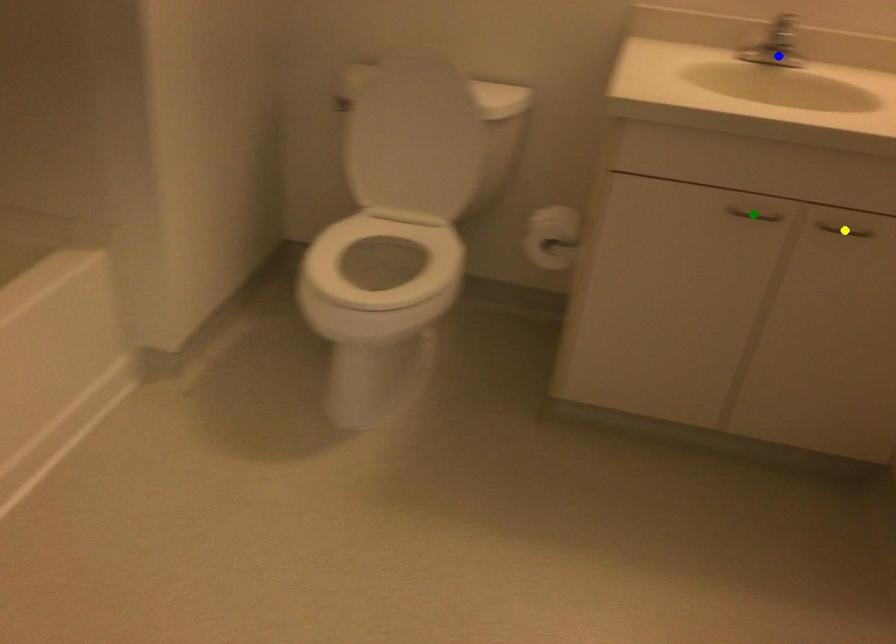
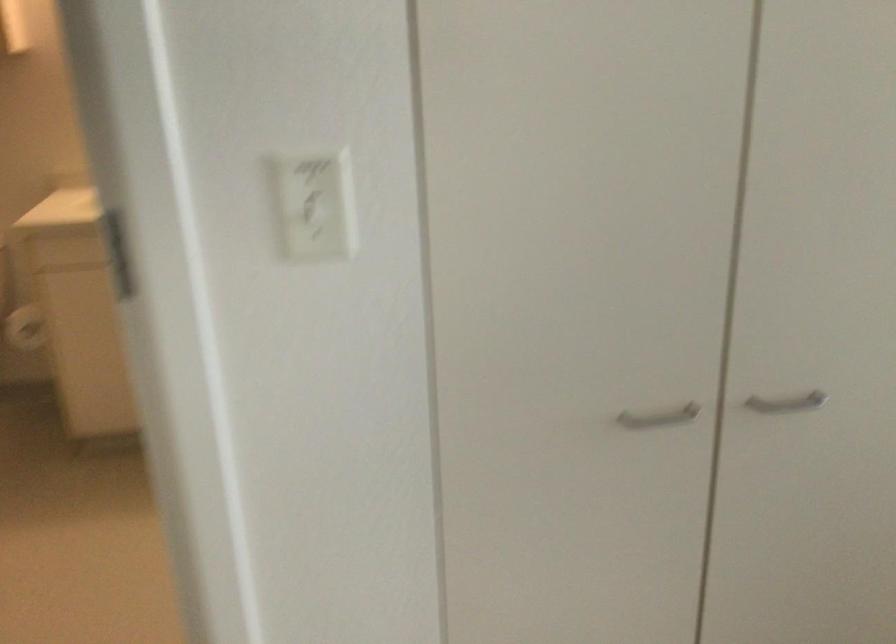
I am providing you with two images of the same scene from different viewpoints. Three points are marked in image1. Which point corresponds to a part or object that is occluded in image2?In image1, three points are marked. Which of them correspond to a part or object that is occluded in image2?Among the three points shown in image1, which one corresponds to a part or object that is no longer visible due to occlusion in image2?

green point, blue point, yellow point